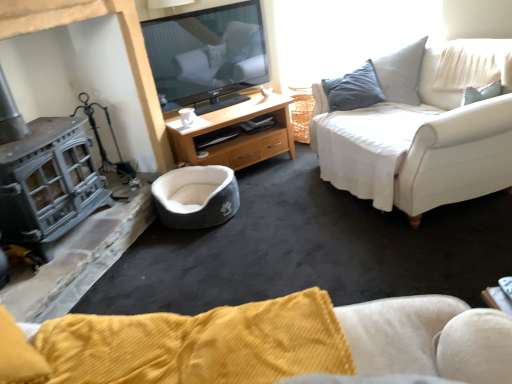
Question: Considering the relative sizes of white fabric couch at right and gray plush pet bed at center in the image provided, is white fabric couch at right smaller than gray plush pet bed at center?

Choices:
 (A) yes
 (B) no

Answer: (B)

Question: Considering the relative sizes of white fabric couch at right and gray plush pet bed at center in the image provided, is white fabric couch at right thinner than gray plush pet bed at center?

Choices:
 (A) no
 (B) yes

Answer: (A)

Question: From a real-world perspective, is white fabric couch at right positioned under gray plush pet bed at center based on gravity?

Choices:
 (A) no
 (B) yes

Answer: (A)

Question: Is white fabric couch at right touching gray plush pet bed at center?

Choices:
 (A) no
 (B) yes

Answer: (A)

Question: Considering the relative sizes of white fabric couch at right and gray plush pet bed at center in the image provided, is white fabric couch at right shorter than gray plush pet bed at center?

Choices:
 (A) no
 (B) yes

Answer: (A)

Question: From the image's perspective, would you say white fabric couch at right is positioned over gray plush pet bed at center?

Choices:
 (A) no
 (B) yes

Answer: (B)

Question: Is gray plush pet bed at center to the left of white glossy coffee cup at center from the viewer's perspective?

Choices:
 (A) yes
 (B) no

Answer: (B)

Question: Is gray plush pet bed at center wider than white glossy coffee cup at center?

Choices:
 (A) no
 (B) yes

Answer: (B)

Question: Is gray plush pet bed at center surrounding white glossy coffee cup at center?

Choices:
 (A) no
 (B) yes

Answer: (A)

Question: Considering the relative sizes of gray plush pet bed at center and white glossy coffee cup at center in the image provided, is gray plush pet bed at center thinner than white glossy coffee cup at center?

Choices:
 (A) no
 (B) yes

Answer: (A)

Question: Is gray plush pet bed at center smaller than white glossy coffee cup at center?

Choices:
 (A) yes
 (B) no

Answer: (B)

Question: Is gray plush pet bed at center positioned far away from white glossy coffee cup at center?

Choices:
 (A) yes
 (B) no

Answer: (B)

Question: Can you confirm if white glossy coffee cup at center is taller than wooden tv stand at center?

Choices:
 (A) no
 (B) yes

Answer: (A)